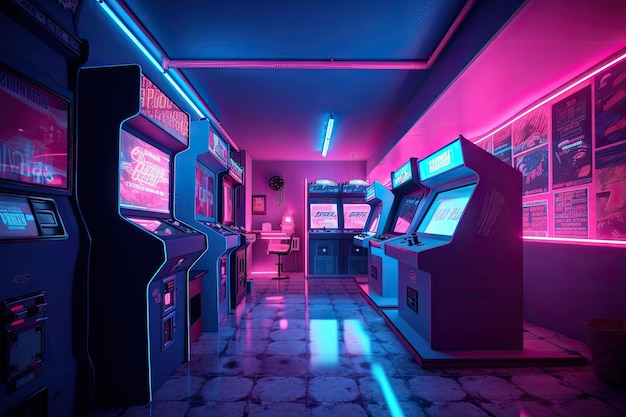
In order to click on blue neon overhead light in this screenshot , I will do `click(183, 99)`, `click(325, 134)`.